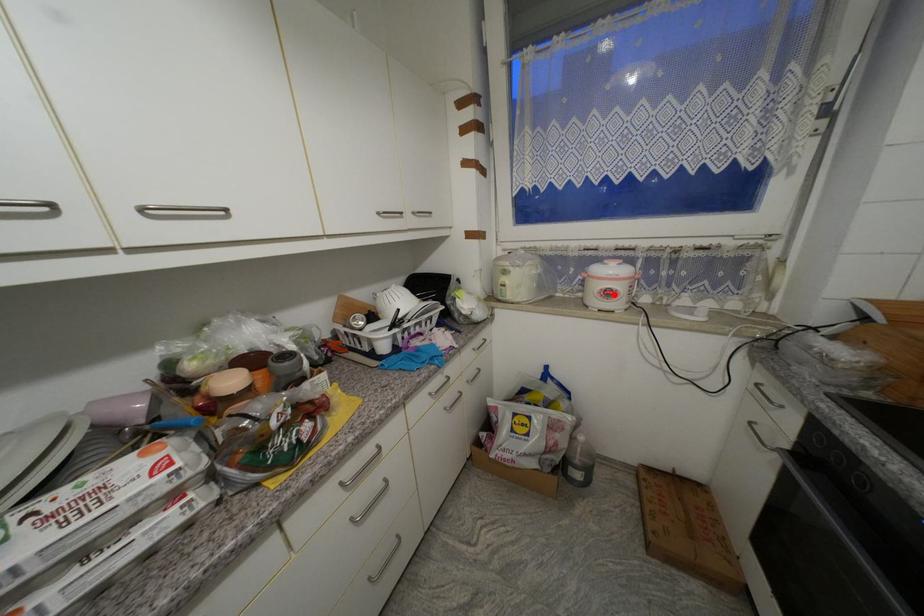
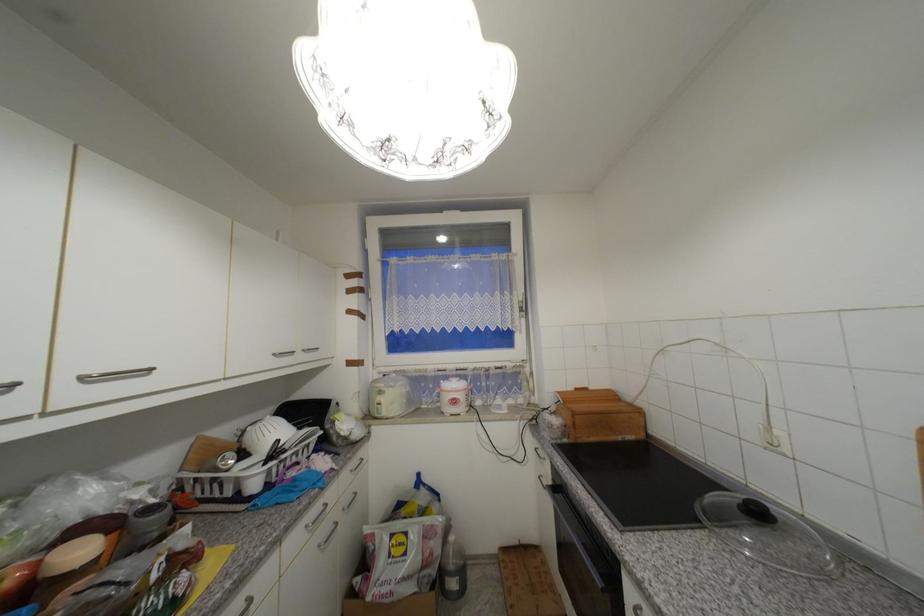
The point at the highlighted location is marked in the first image. Where is the corresponding point in the second image?

(459, 403)